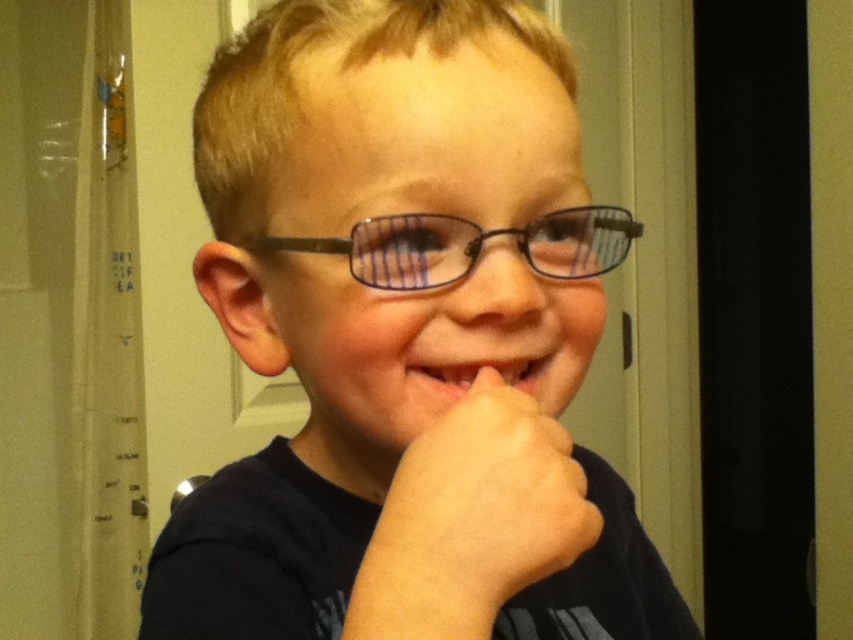
Between matte black glasses at center and pink glossy lips at center, which one appears on the left side from the viewer's perspective?

matte black glasses at center

Is matte black glasses at center in front of pink glossy lips at center?

Yes, matte black glasses at center is closer to the viewer.

Locate an element on the screen. The image size is (853, 640). matte black glasses at center is located at coordinates (405, 339).

Does matte black glasses at center have a smaller size compared to black plastic glasses at center?

No.

Is matte black glasses at center to the right of black plastic glasses at center from the viewer's perspective?

No, matte black glasses at center is not to the right of black plastic glasses at center.

Is point (442, 248) closer to camera compared to point (263, 243)?

Yes, point (442, 248) is in front of point (263, 243).

You are a GUI agent. You are given a task and a screenshot of the screen. Output one action in this format:
    pyautogui.click(x=<x>, y=<y>)
    Task: Click on the matte black glasses at center
    Image resolution: width=853 pixels, height=640 pixels.
    Given the screenshot: What is the action you would take?
    pyautogui.click(x=405, y=339)

Between black plastic glasses at center and pink glossy lips at center, which one appears on the right side from the viewer's perspective?

pink glossy lips at center

Does point (639, 228) come farther from viewer compared to point (572, 396)?

Yes, point (639, 228) is farther from viewer.

The width and height of the screenshot is (853, 640). What are the coordinates of `black plastic glasses at center` in the screenshot? It's located at (469, 246).